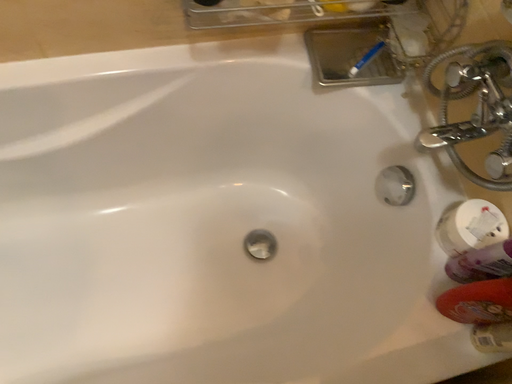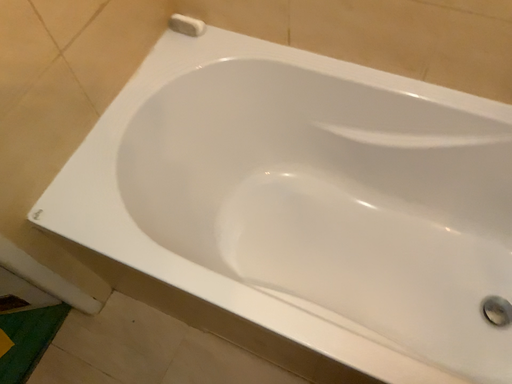
Question: Which way did the camera rotate in the video?

Choices:
 (A) rotated downward
 (B) rotated upward

Answer: (B)